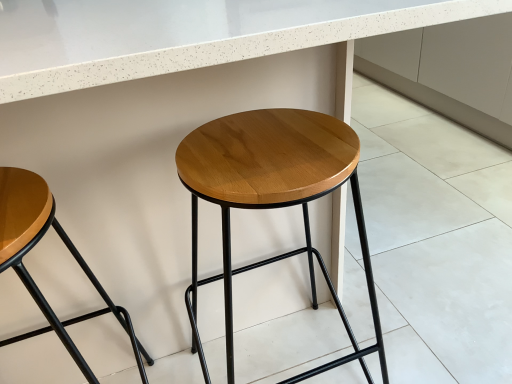
Find the location of a particular element. This screenshot has width=512, height=384. wooden/matte stool at center, which is the second stool in left-to-right order is located at coordinates (273, 199).

What do you see at coordinates (273, 199) in the screenshot? The height and width of the screenshot is (384, 512). I see `wooden/matte stool at center, placed as the 1th stool when sorted from right to left` at bounding box center [273, 199].

The height and width of the screenshot is (384, 512). What do you see at coordinates (34, 245) in the screenshot? I see `wooden seat at left, the 2th stool from the right` at bounding box center [34, 245].

You are a GUI agent. You are given a task and a screenshot of the screen. Output one action in this format:
    pyautogui.click(x=<x>, y=<y>)
    Task: Click on the wooden seat at left, the 1th stool when ordered from left to right
    The image size is (512, 384).
    Given the screenshot: What is the action you would take?
    pyautogui.click(x=34, y=245)

At what (x,y) coordinates should I click in order to perform the action: click on wooden/matte stool at center, which is the second stool in left-to-right order. Please return your answer as a coordinate pair (x, y). The width and height of the screenshot is (512, 384). Looking at the image, I should click on (273, 199).

From the picture: Can you confirm if wooden seat at left, the 1th stool when ordered from left to right, is positioned to the right of wooden/matte stool at center, placed as the 1th stool when sorted from right to left?

No.

In the image, is wooden seat at left, the 2th stool from the right, positioned in front of or behind wooden/matte stool at center, which is the second stool in left-to-right order?

In the image, wooden seat at left, the 2th stool from the right, appears in front of wooden/matte stool at center, which is the second stool in left-to-right order.

Is point (144, 355) farther from camera compared to point (358, 356)?

No, (144, 355) is closer to viewer.

From the image's perspective, is wooden seat at left, the 2th stool from the right, over wooden/matte stool at center, placed as the 1th stool when sorted from right to left?

Incorrect, from the image's perspective, wooden seat at left, the 2th stool from the right, is lower than wooden/matte stool at center, placed as the 1th stool when sorted from right to left.

From a real-world perspective, is wooden seat at left, the 1th stool when ordered from left to right, physically above wooden/matte stool at center, which is the second stool in left-to-right order?

Yes, from a real-world perspective, wooden seat at left, the 1th stool when ordered from left to right, is above wooden/matte stool at center, which is the second stool in left-to-right order.

Can you confirm if wooden seat at left, the 1th stool when ordered from left to right, is wider than wooden/matte stool at center, placed as the 1th stool when sorted from right to left?

Incorrect, the width of wooden seat at left, the 1th stool when ordered from left to right, does not surpass that of wooden/matte stool at center, placed as the 1th stool when sorted from right to left.

In the scene shown: Between wooden seat at left, the 2th stool from the right, and wooden/matte stool at center, placed as the 1th stool when sorted from right to left, which one has more height?

wooden/matte stool at center, placed as the 1th stool when sorted from right to left.

Considering the relative sizes of wooden seat at left, the 1th stool when ordered from left to right, and wooden/matte stool at center, which is the second stool in left-to-right order, in the image provided, is wooden seat at left, the 1th stool when ordered from left to right, smaller than wooden/matte stool at center, which is the second stool in left-to-right order,?

Correct, wooden seat at left, the 1th stool when ordered from left to right, occupies less space than wooden/matte stool at center, which is the second stool in left-to-right order.

Is wooden seat at left, the 1th stool when ordered from left to right, inside the boundaries of wooden/matte stool at center, placed as the 1th stool when sorted from right to left, or outside?

wooden seat at left, the 1th stool when ordered from left to right, exists outside the volume of wooden/matte stool at center, placed as the 1th stool when sorted from right to left.

Is wooden seat at left, the 1th stool when ordered from left to right, in contact with wooden/matte stool at center, which is the second stool in left-to-right order?

No, wooden seat at left, the 1th stool when ordered from left to right, is not in contact with wooden/matte stool at center, which is the second stool in left-to-right order.

Is wooden seat at left, the 1th stool when ordered from left to right, aimed at wooden/matte stool at center, placed as the 1th stool when sorted from right to left?

No, wooden seat at left, the 1th stool when ordered from left to right, does not turn towards wooden/matte stool at center, placed as the 1th stool when sorted from right to left.

How different are the orientations of wooden seat at left, the 1th stool when ordered from left to right, and wooden/matte stool at center, placed as the 1th stool when sorted from right to left, in degrees?

They differ by 7.15e-05 degrees in their facing directions.

How much distance is there between wooden seat at left, the 1th stool when ordered from left to right, and wooden/matte stool at center, placed as the 1th stool when sorted from right to left?

wooden seat at left, the 1th stool when ordered from left to right, is 14.18 inches away from wooden/matte stool at center, placed as the 1th stool when sorted from right to left.

Image resolution: width=512 pixels, height=384 pixels. I want to click on stool in front of the wooden/matte stool at center, placed as the 1th stool when sorted from right to left, so click(x=34, y=245).

From the picture: Which is more to the left, wooden/matte stool at center, placed as the 1th stool when sorted from right to left, or wooden seat at left, the 2th stool from the right?

wooden seat at left, the 2th stool from the right, is more to the left.

Considering the positions of objects wooden/matte stool at center, placed as the 1th stool when sorted from right to left, and wooden seat at left, the 1th stool when ordered from left to right, in the image provided, who is behind, wooden/matte stool at center, placed as the 1th stool when sorted from right to left, or wooden seat at left, the 1th stool when ordered from left to right,?

wooden/matte stool at center, placed as the 1th stool when sorted from right to left, is behind.

Considering the points (306, 249) and (24, 199), which point is behind, point (306, 249) or point (24, 199)?

The point (306, 249) is behind.

From the image's perspective, between wooden/matte stool at center, placed as the 1th stool when sorted from right to left, and wooden seat at left, the 2th stool from the right, who is located below?

wooden seat at left, the 2th stool from the right, is shown below in the image.

From a real-world perspective, is wooden/matte stool at center, which is the second stool in left-to-right order, located beneath wooden seat at left, the 2th stool from the right?

Correct, in the physical world, wooden/matte stool at center, which is the second stool in left-to-right order, is lower than wooden seat at left, the 2th stool from the right.

Which of these two, wooden/matte stool at center, which is the second stool in left-to-right order, or wooden seat at left, the 1th stool when ordered from left to right, is wider?

With larger width is wooden/matte stool at center, which is the second stool in left-to-right order.

Who is shorter, wooden/matte stool at center, which is the second stool in left-to-right order, or wooden seat at left, the 1th stool when ordered from left to right?

wooden seat at left, the 1th stool when ordered from left to right, is shorter.

Does wooden/matte stool at center, which is the second stool in left-to-right order, have a smaller size compared to wooden seat at left, the 1th stool when ordered from left to right?

Actually, wooden/matte stool at center, which is the second stool in left-to-right order, might be larger than wooden seat at left, the 1th stool when ordered from left to right.

Is wooden/matte stool at center, placed as the 1th stool when sorted from right to left, positioned beyond the bounds of wooden seat at left, the 1th stool when ordered from left to right?

Yes, wooden/matte stool at center, placed as the 1th stool when sorted from right to left, is located beyond the bounds of wooden seat at left, the 1th stool when ordered from left to right.

Is wooden/matte stool at center, which is the second stool in left-to-right order, beside wooden seat at left, the 1th stool when ordered from left to right?

There is a gap between wooden/matte stool at center, which is the second stool in left-to-right order, and wooden seat at left, the 1th stool when ordered from left to right.

Is wooden/matte stool at center, placed as the 1th stool when sorted from right to left, turned away from wooden seat at left, the 2th stool from the right?

That's not correct — wooden/matte stool at center, placed as the 1th stool when sorted from right to left, is not looking away from wooden seat at left, the 2th stool from the right.

Can you tell me how much wooden/matte stool at center, which is the second stool in left-to-right order, and wooden seat at left, the 1th stool when ordered from left to right, differ in facing direction?

The angle between the facing direction of wooden/matte stool at center, which is the second stool in left-to-right order, and the facing direction of wooden seat at left, the 1th stool when ordered from left to right, is 7.15e-05 degrees.

Could you measure the distance between wooden/matte stool at center, placed as the 1th stool when sorted from right to left, and wooden seat at left, the 2th stool from the right?

wooden/matte stool at center, placed as the 1th stool when sorted from right to left, and wooden seat at left, the 2th stool from the right, are 14.18 inches apart from each other.

Find the location of a particular element. This screenshot has height=384, width=512. stool below the wooden/matte stool at center, which is the second stool in left-to-right order (from the image's perspective) is located at coordinates (34, 245).

This screenshot has height=384, width=512. I want to click on stool below the wooden/matte stool at center, which is the second stool in left-to-right order (from the image's perspective), so click(x=34, y=245).

Locate an element on the screen. The width and height of the screenshot is (512, 384). stool that is on the left side of wooden/matte stool at center, placed as the 1th stool when sorted from right to left is located at coordinates (34, 245).